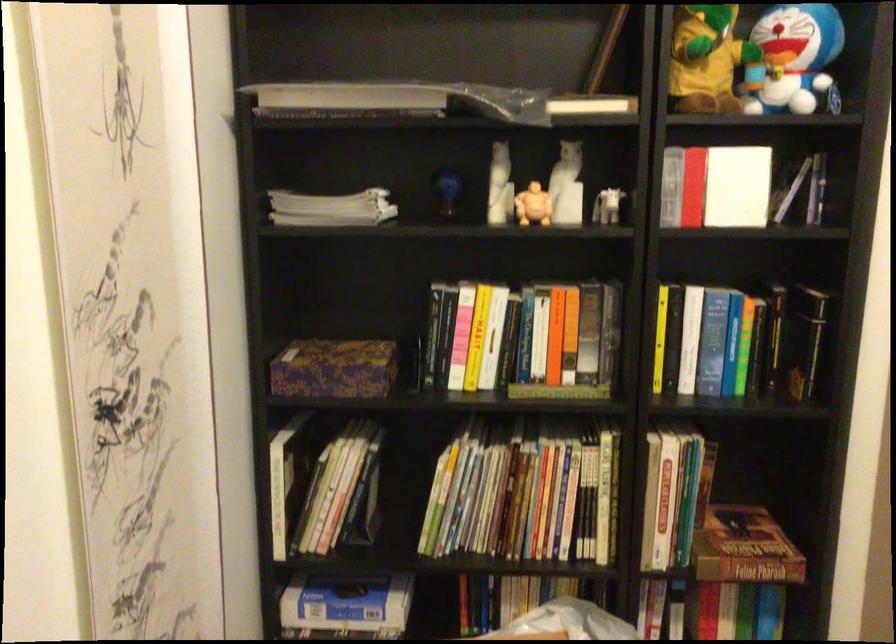
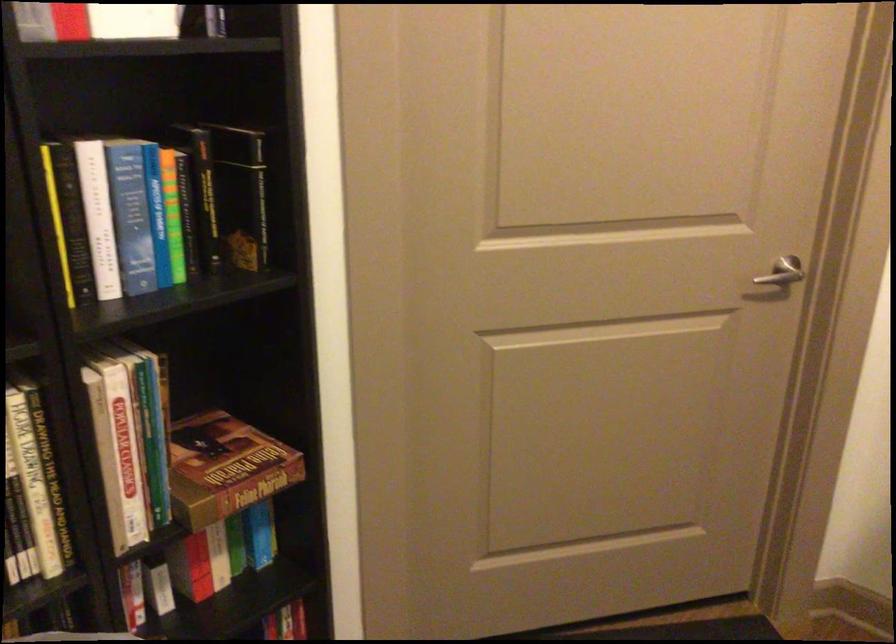
In the second image, find the point that corresponds to point 748,339 in the first image.

(171, 214)